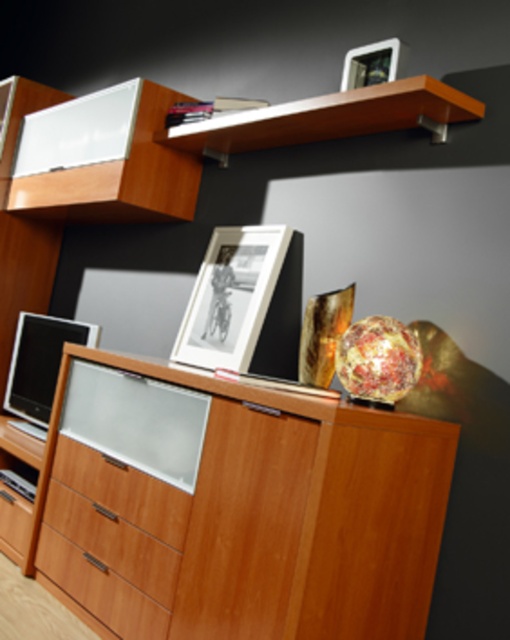
Question: Which point is closer to the camera taking this photo?

Choices:
 (A) (11, 525)
 (B) (95, 506)

Answer: (B)

Question: In this image, where is matte white cabinet at upper left located relative to brown wood drawer at lower left?

Choices:
 (A) above
 (B) below

Answer: (A)

Question: Which of these objects is positioned farthest from the wooden dresser at center?

Choices:
 (A) light wood drawer at lower center
 (B) matte black picture frame at upper center

Answer: (B)

Question: Which object is the closest to the matte white cabinet at upper left?

Choices:
 (A) wooden shelf at upper center
 (B) wooden dresser at center
 (C) matte black frame at upper center

Answer: (A)

Question: Does light wood drawer at lower center have a lesser width compared to matte black picture frame at upper center?

Choices:
 (A) no
 (B) yes

Answer: (A)

Question: Does wooden dresser at center appear over wooden drawer at lower left?

Choices:
 (A) no
 (B) yes

Answer: (B)